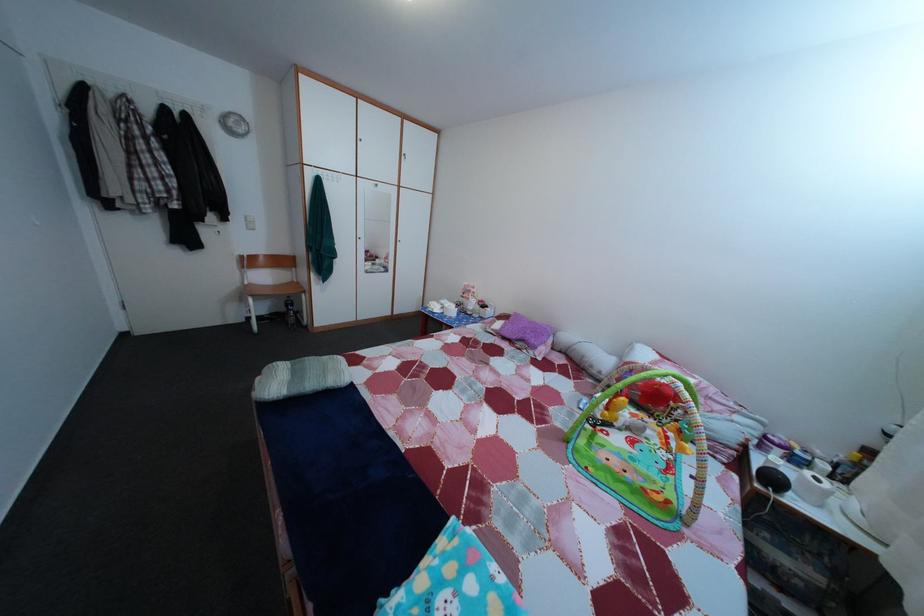
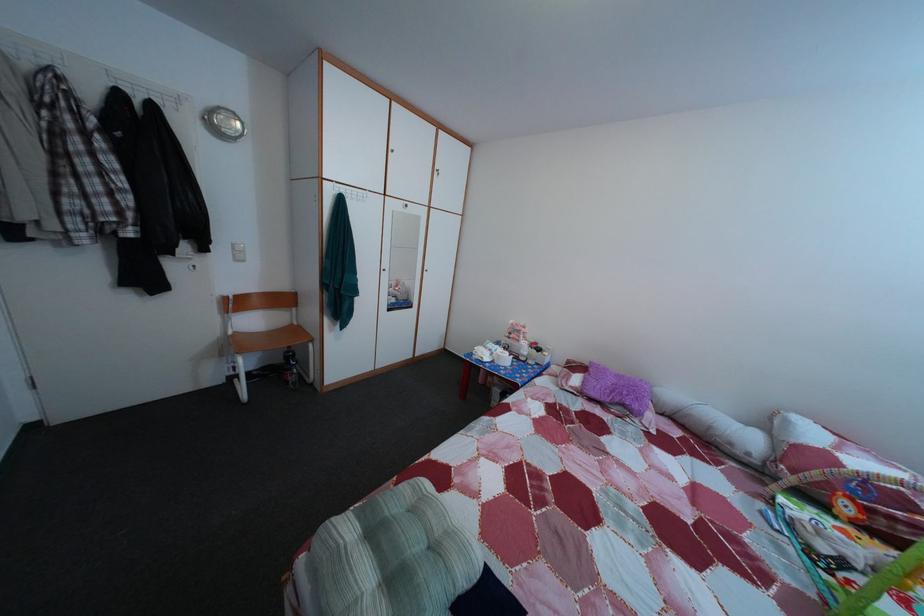
Question: The camera is either moving clockwise (left) or counter-clockwise (right) around the object. The first image is from the beginning of the video and the second image is from the end. Is the camera moving left or right when shooting the video?

Choices:
 (A) Left
 (B) Right

Answer: (A)